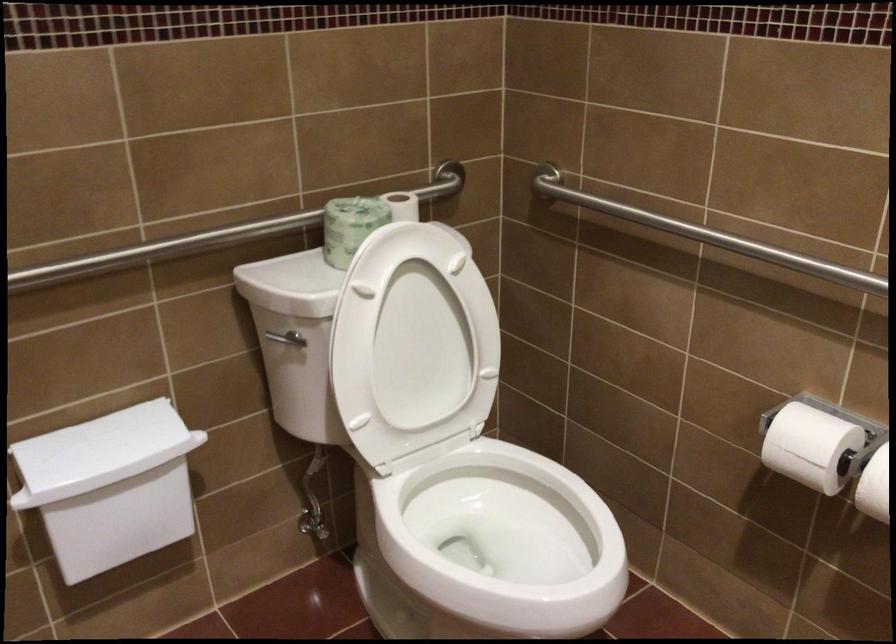
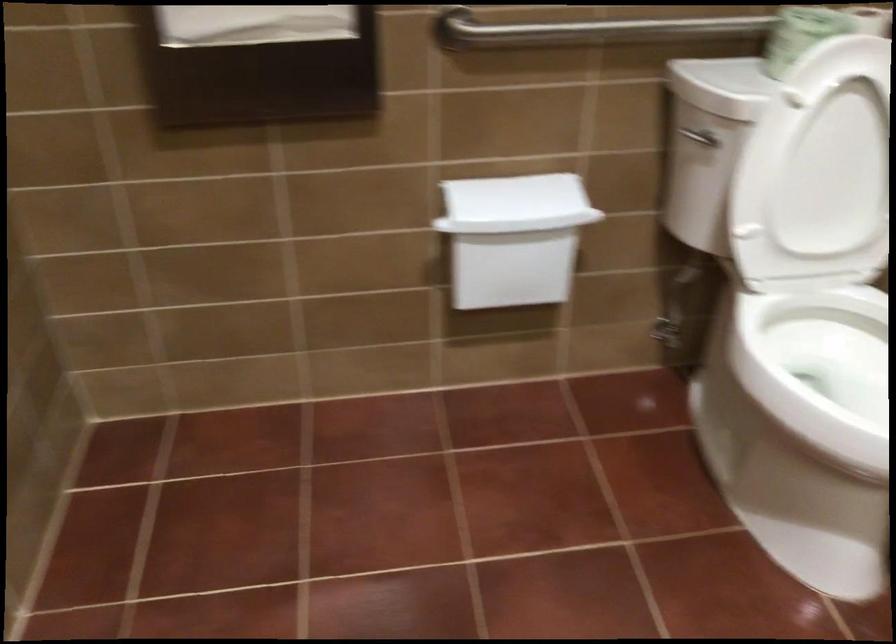
Question: How did the camera likely rotate?

Choices:
 (A) Left
 (B) Right
 (C) Up
 (D) Down

Answer: (A)